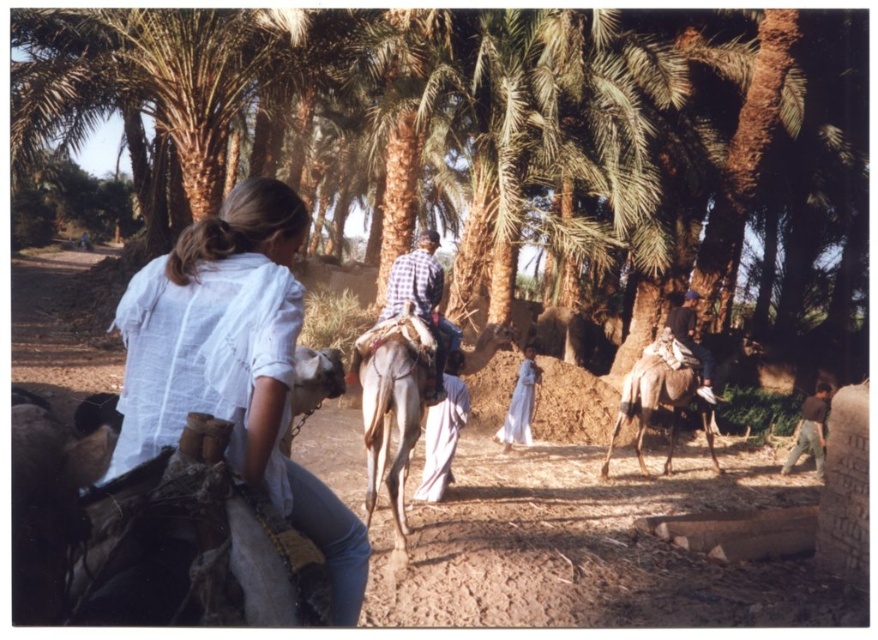
Who is more distant from viewer, (663, 406) or (682, 336)?

Point (663, 406)

The width and height of the screenshot is (878, 640). I want to click on light brown textured camel at right, so click(659, 404).

Find the location of a particular element. This screenshot has height=640, width=878. light brown textured camel at right is located at coordinates (659, 404).

Who is more forward, [307,472] or [511,440]?

Point [307,472]

Image resolution: width=878 pixels, height=640 pixels. Identify the location of white cotton shirt at center. (234, 364).

Based on the photo, can you confirm if light brown textured camel at center is thinner than brown cotton shirt at lower right?

No.

Which is behind, point (365, 372) or point (817, 429)?

Positioned behind is point (817, 429).

Identify the location of light brown textured camel at center. (396, 403).